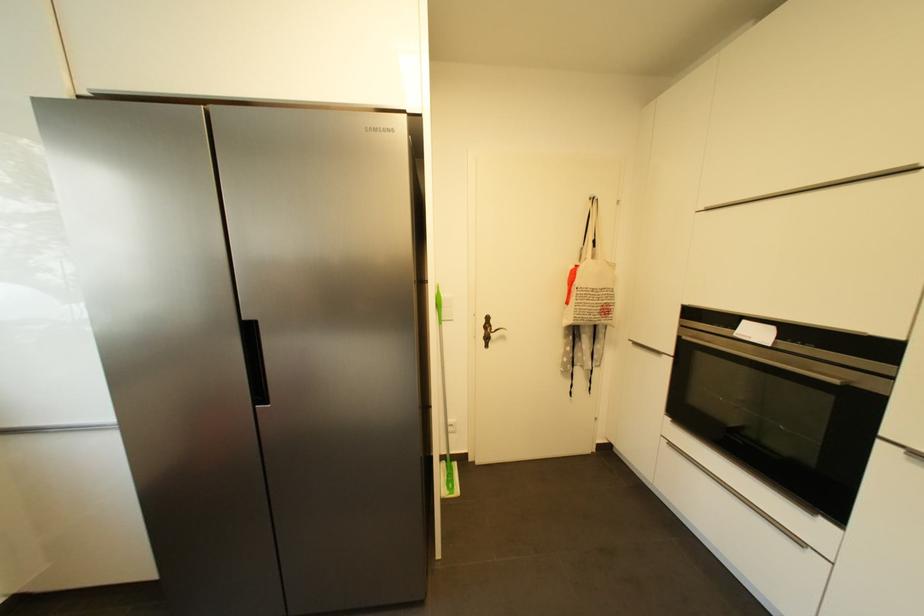
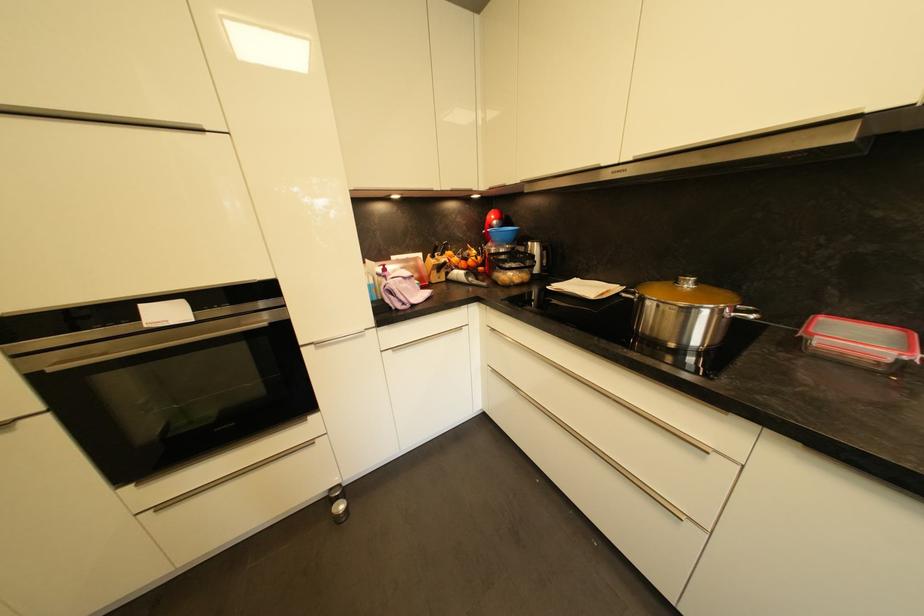
First-person continuous shooting, in which direction is the camera rotating?

The camera rotated toward right-down.